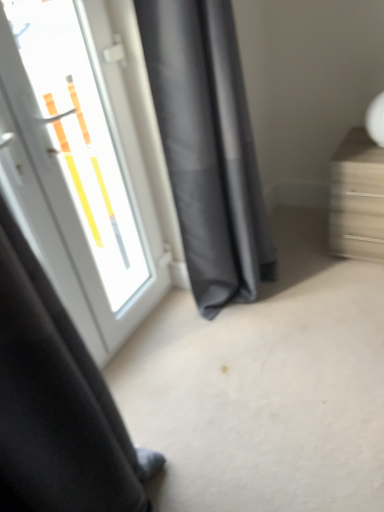
Question: From a real-world perspective, relative to wooden drawer at right, is white glossy door at upper left vertically above or below?

Choices:
 (A) below
 (B) above

Answer: (B)

Question: Based on their sizes in the image, would you say white glossy door at upper left is bigger or smaller than wooden drawer at right?

Choices:
 (A) big
 (B) small

Answer: (A)

Question: Which object is positioned closest to the wooden drawer at right?

Choices:
 (A) dark gray fabric curtain at center
 (B) white glossy door at upper left

Answer: (A)

Question: Estimate the real-world distances between objects in this image. Which object is farther from the dark gray fabric curtain at center?

Choices:
 (A) white glossy door at upper left
 (B) wooden drawer at right

Answer: (B)